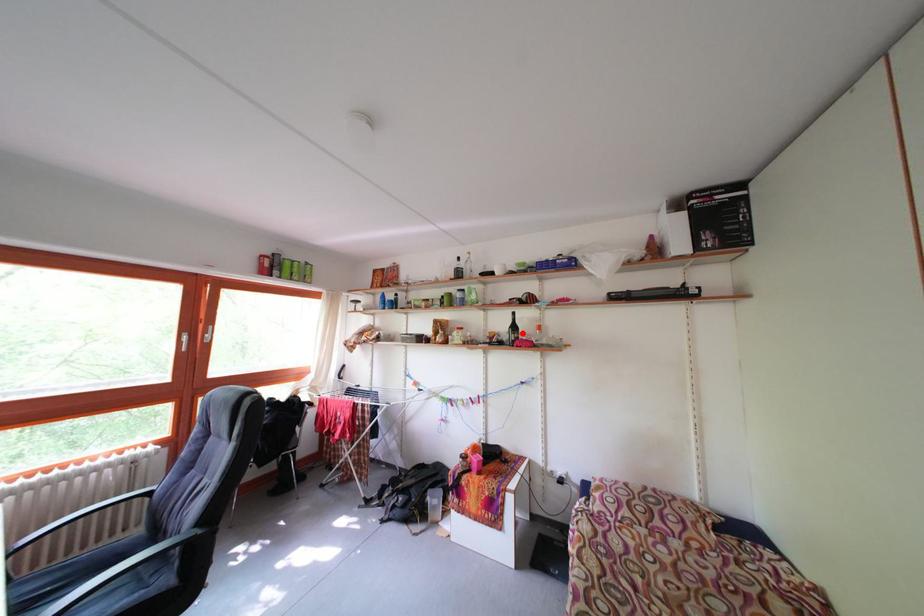
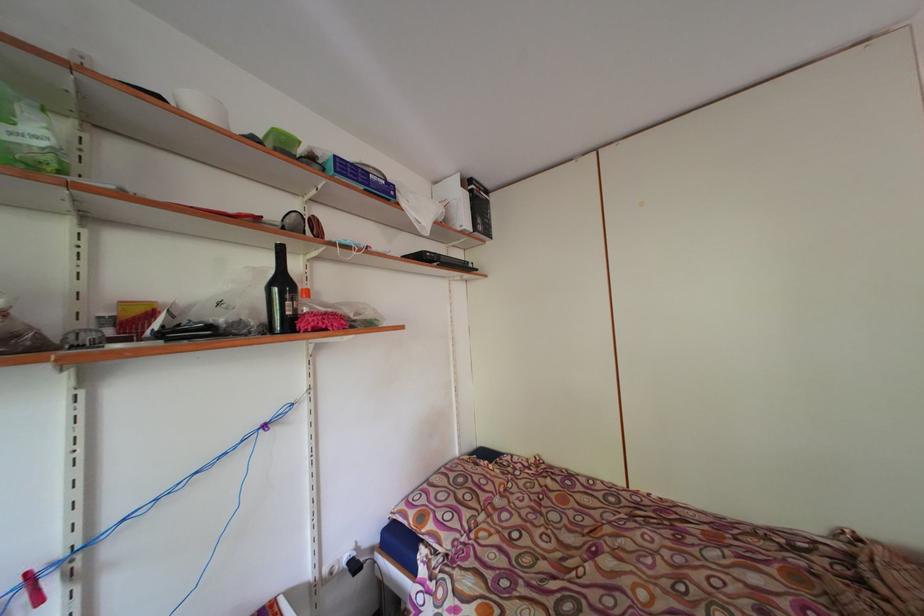
Question: I am providing you with two images of the same scene from different viewpoints. A red point is marked on the first image. Is the red point's position out of view in image 2?

Choices:
 (A) Yes
 (B) No

Answer: (B)